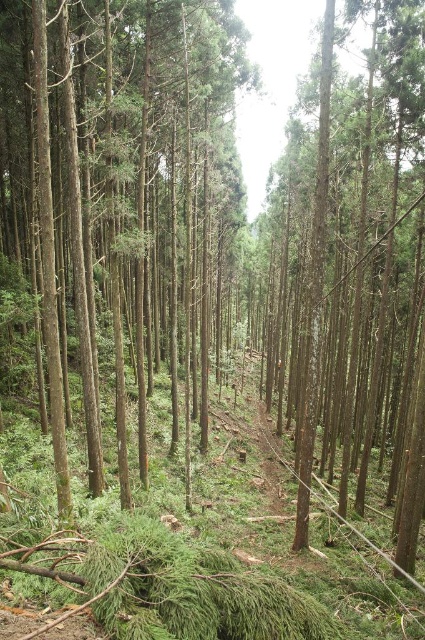
Between point (150, 198) and point (299, 268), which one is positioned behind?

Positioned behind is point (299, 268).

Who is more forward, (136, 369) or (396, 113)?

Point (396, 113)

Which is behind, point (215, 275) or point (384, 298)?

The point (215, 275) is more distant.

Locate an element on the screen. This screenshot has width=425, height=640. green smooth tree at center is located at coordinates (110, 196).